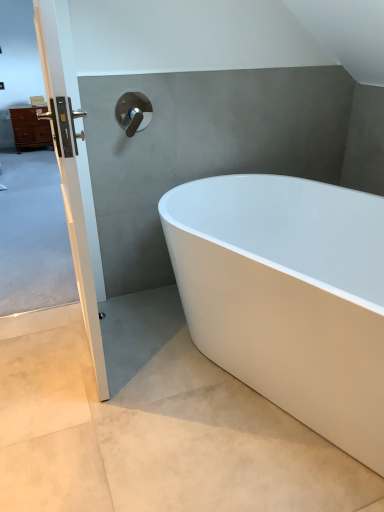
Identify the location of free location in front of white glossy door handle at left. (89, 413).